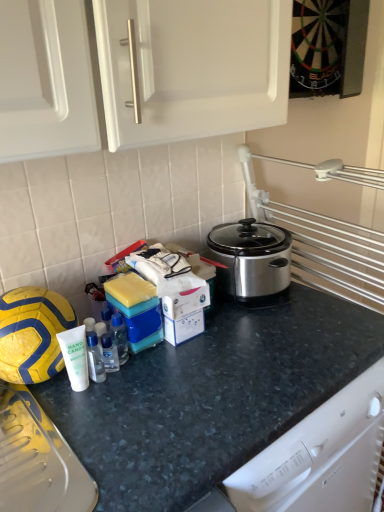
Question: Would you say yellow matte football at left is a long distance from clear plastic bottle at center, the 1th bottle from the front?

Choices:
 (A) no
 (B) yes

Answer: (A)

Question: From the image's perspective, does yellow matte football at left appear lower than clear plastic bottle at center, the 1th bottle from the front?

Choices:
 (A) yes
 (B) no

Answer: (B)

Question: Does yellow matte football at left have a lesser height compared to clear plastic bottle at center, which appears as the 2th bottle when viewed from the back?

Choices:
 (A) no
 (B) yes

Answer: (A)

Question: Is yellow matte football at left to the left of clear plastic bottle at center, the 1th bottle from the front, from the viewer's perspective?

Choices:
 (A) yes
 (B) no

Answer: (A)

Question: Can you confirm if yellow matte football at left is thinner than clear plastic bottle at center, the 1th bottle from the front?

Choices:
 (A) no
 (B) yes

Answer: (A)

Question: Is yellow matte football at left located outside clear plastic bottle at center, which is the 2th bottle in right-to-left order?

Choices:
 (A) no
 (B) yes

Answer: (B)

Question: Is transparent plastic bottle at center, positioned as the 1th bottle in right-to-left order, bigger than clear plastic bottle at center, the 1th bottle from the front?

Choices:
 (A) yes
 (B) no

Answer: (A)

Question: Can we say transparent plastic bottle at center, marked as the first bottle in a back-to-front arrangement, lies outside clear plastic bottle at center, the 1th bottle in the left-to-right sequence?

Choices:
 (A) no
 (B) yes

Answer: (B)

Question: Is transparent plastic bottle at center, arranged as the 2th bottle when viewed from the front, taller than clear plastic bottle at center, the 1th bottle from the front?

Choices:
 (A) no
 (B) yes

Answer: (B)

Question: Can you confirm if transparent plastic bottle at center, marked as the first bottle in a back-to-front arrangement, is wider than clear plastic bottle at center, the 1th bottle from the front?

Choices:
 (A) no
 (B) yes

Answer: (A)

Question: From the image's perspective, would you say transparent plastic bottle at center, marked as the first bottle in a back-to-front arrangement, is positioned over clear plastic bottle at center, the 1th bottle in the left-to-right sequence?

Choices:
 (A) yes
 (B) no

Answer: (A)

Question: From the image's perspective, is transparent plastic bottle at center, the 2th bottle positioned from the left, under clear plastic bottle at center, the 1th bottle from the front?

Choices:
 (A) no
 (B) yes

Answer: (A)

Question: Considering the relative positions of dark gray granite countertop at center and clear plastic bottle at center, which appears as the 2th bottle when viewed from the back, in the image provided, is dark gray granite countertop at center to the left of clear plastic bottle at center, which appears as the 2th bottle when viewed from the back, from the viewer's perspective?

Choices:
 (A) no
 (B) yes

Answer: (A)